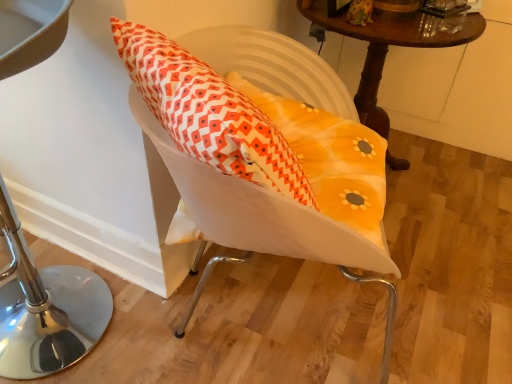
Question: Is the position of wooden table at upper right less distant than that of metallic stool at left?

Choices:
 (A) yes
 (B) no

Answer: (B)

Question: From the image's perspective, would you say wooden table at upper right is shown under metallic stool at left?

Choices:
 (A) yes
 (B) no

Answer: (B)

Question: Considering the relative sizes of wooden table at upper right and metallic stool at left in the image provided, is wooden table at upper right bigger than metallic stool at left?

Choices:
 (A) no
 (B) yes

Answer: (B)

Question: Is wooden table at upper right oriented away from metallic stool at left?

Choices:
 (A) no
 (B) yes

Answer: (A)

Question: Is wooden table at upper right taller than metallic stool at left?

Choices:
 (A) yes
 (B) no

Answer: (B)

Question: Considering the relative positions of metallic stool at left and white fabric swivel chair at center in the image provided, is metallic stool at left to the left or to the right of white fabric swivel chair at center?

Choices:
 (A) right
 (B) left

Answer: (B)

Question: Is point click(14, 31) closer or farther from the camera than point click(376, 190)?

Choices:
 (A) closer
 (B) farther

Answer: (A)

Question: From their relative heights in the image, would you say metallic stool at left is taller or shorter than white fabric swivel chair at center?

Choices:
 (A) short
 (B) tall

Answer: (B)

Question: Is metallic stool at left inside or outside of white fabric swivel chair at center?

Choices:
 (A) outside
 (B) inside

Answer: (A)

Question: From the image's perspective, relative to wooden table at upper right, is white fabric swivel chair at center above or below?

Choices:
 (A) above
 (B) below

Answer: (B)

Question: Considering their positions, is white fabric swivel chair at center located in front of or behind wooden table at upper right?

Choices:
 (A) front
 (B) behind

Answer: (A)

Question: In terms of size, does white fabric swivel chair at center appear bigger or smaller than wooden table at upper right?

Choices:
 (A) big
 (B) small

Answer: (B)

Question: Do you think white fabric swivel chair at center is within wooden table at upper right, or outside of it?

Choices:
 (A) outside
 (B) inside

Answer: (A)

Question: In terms of width, does wooden table at upper right look wider or thinner when compared to white fabric swivel chair at center?

Choices:
 (A) thin
 (B) wide

Answer: (B)

Question: Considering the positions of point (384, 49) and point (198, 203), is point (384, 49) closer or farther from the camera than point (198, 203)?

Choices:
 (A) farther
 (B) closer

Answer: (A)